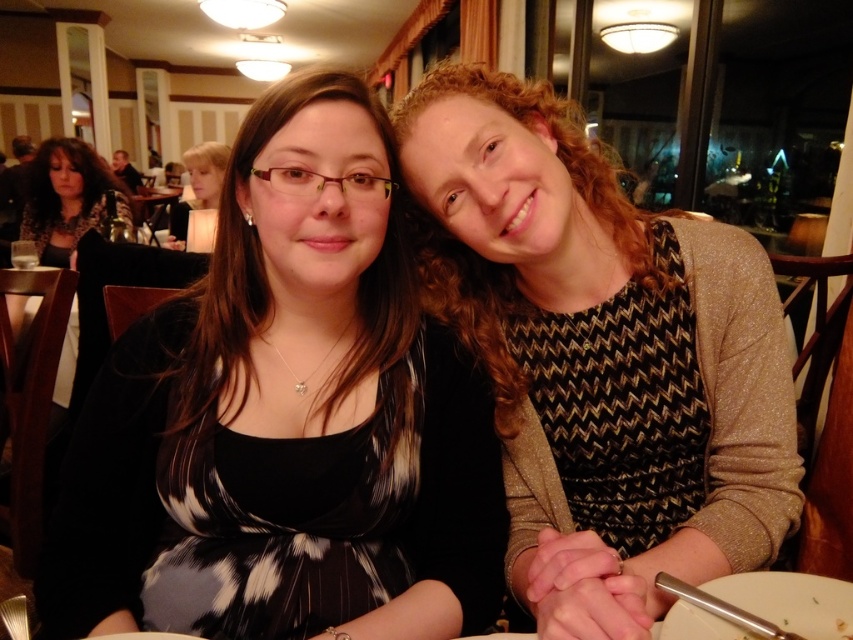
Can you confirm if sparkly gold sweater at right is positioned to the right of white ceramic plate at lower right?

No, sparkly gold sweater at right is not to the right of white ceramic plate at lower right.

Is point (440, 200) positioned in front of point (706, 637)?

No, it is behind (706, 637).

Find the location of a particular element. Image resolution: width=853 pixels, height=640 pixels. sparkly gold sweater at right is located at coordinates (601, 356).

Locate an element on the screen. sparkly gold sweater at right is located at coordinates (601, 356).

Does black printed dress at center come behind white ceramic plate at lower right?

Yes, black printed dress at center is behind white ceramic plate at lower right.

Between black printed dress at center and white ceramic plate at lower right, which one has more height?

black printed dress at center is taller.

You are a GUI agent. You are given a task and a screenshot of the screen. Output one action in this format:
    pyautogui.click(x=<x>, y=<y>)
    Task: Click on the black printed dress at center
    This screenshot has height=640, width=853.
    Given the screenshot: What is the action you would take?
    pyautogui.click(x=286, y=419)

Describe the element at coordinates (601, 356) in the screenshot. The width and height of the screenshot is (853, 640). I see `sparkly gold sweater at right` at that location.

Is point (601, 348) farther from camera compared to point (88, 211)?

No, (601, 348) is closer to viewer.

This screenshot has height=640, width=853. Describe the element at coordinates (601, 356) in the screenshot. I see `sparkly gold sweater at right` at that location.

This screenshot has height=640, width=853. I want to click on sparkly gold sweater at right, so click(601, 356).